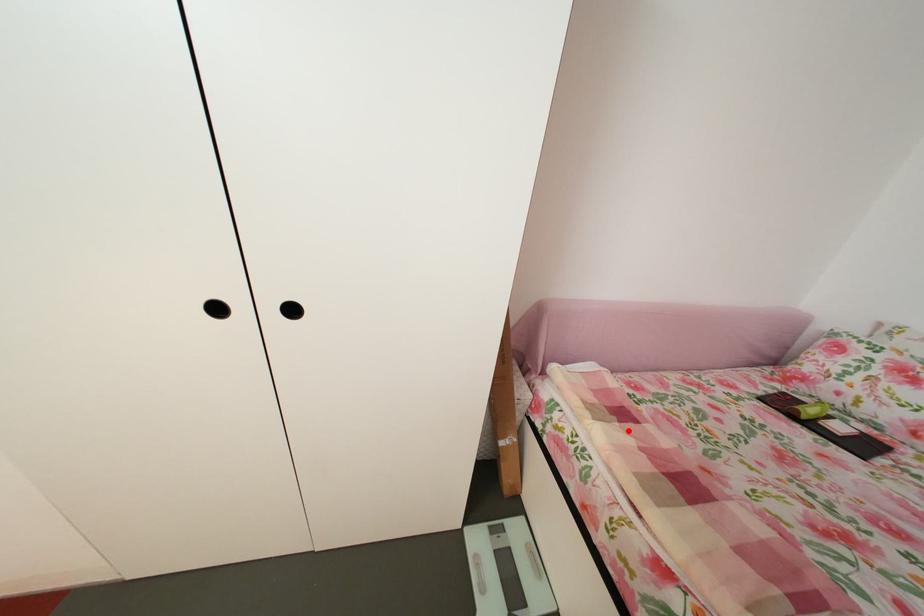
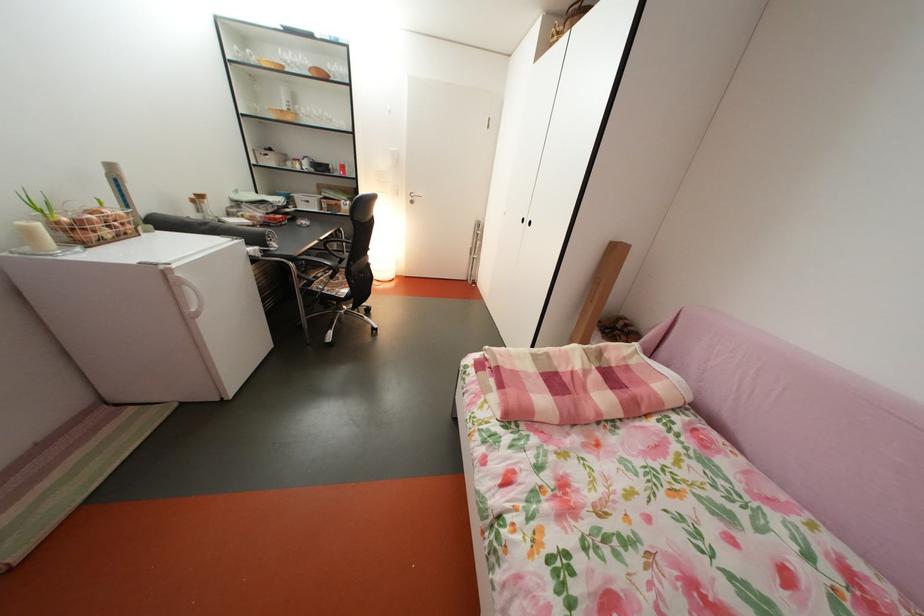
Find the pixel in the second image that matches the highlighted location in the first image.

(604, 374)